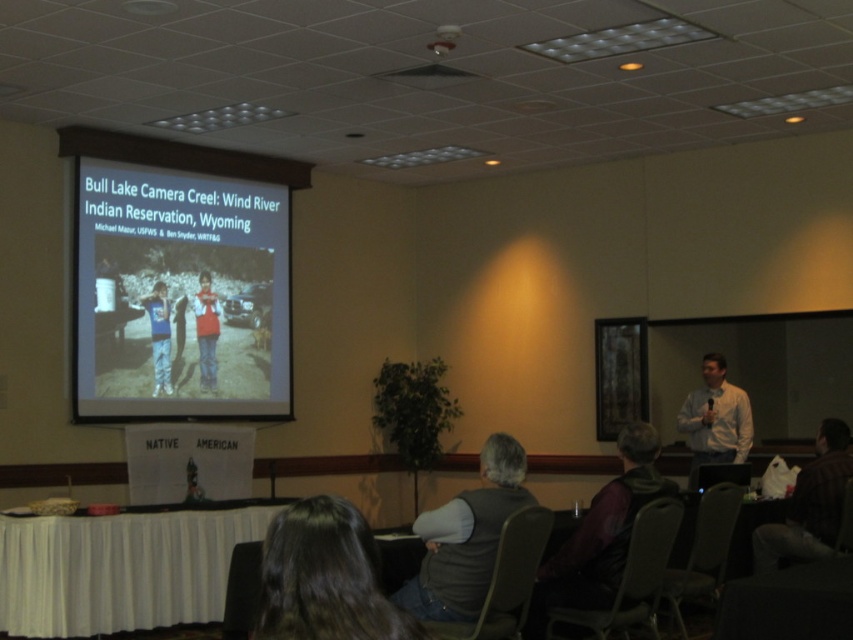
Is white cloth-covered table at lower left smaller than dark brown hair at lower center?

No.

Does white cloth-covered table at lower left have a larger size compared to dark brown hair at lower center?

Yes, white cloth-covered table at lower left is bigger than dark brown hair at lower center.

Which is behind, point (67, 566) or point (277, 637)?

Positioned behind is point (67, 566).

Find the location of a particular element. The image size is (853, 640). white cloth-covered table at lower left is located at coordinates (119, 570).

Does matte plastic projector screen at upper left come in front of white cloth-covered table at lower left?

No, matte plastic projector screen at upper left is behind white cloth-covered table at lower left.

Based on the photo, is matte plastic projector screen at upper left above white cloth-covered table at lower left?

Indeed, matte plastic projector screen at upper left is positioned over white cloth-covered table at lower left.

What are the coordinates of `matte plastic projector screen at upper left` in the screenshot? It's located at (178, 294).

Locate an element on the screen. Image resolution: width=853 pixels, height=640 pixels. matte plastic projector screen at upper left is located at coordinates (178, 294).

Which is in front, point (724, 376) or point (152, 339)?

Point (724, 376) is more forward.

The image size is (853, 640). Describe the element at coordinates (715, 419) in the screenshot. I see `white shirt at center` at that location.

Locate an element on the screen. The height and width of the screenshot is (640, 853). white shirt at center is located at coordinates (715, 419).